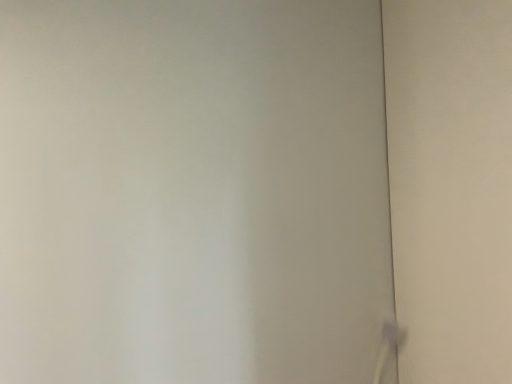
Image resolution: width=512 pixels, height=384 pixels. What do you see at coordinates (451, 185) in the screenshot?
I see `white matte door at right` at bounding box center [451, 185].

Identify the location of white matte door at right. This screenshot has height=384, width=512. (451, 185).

Find the location of a particular element. white matte door at right is located at coordinates (451, 185).